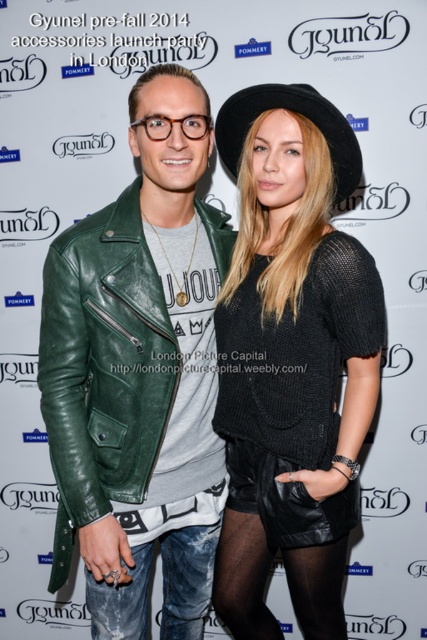
You are a photographer at the Gyunel pre fall 2014 accessories launch party in London. You need to position two markers for the guests to stand on. The markers are placed at point [328,298] and point [233,474]. Which marker is closer to the camera?

Point [328,298] is in front of point [233,474], so the marker at point [328,298] is closer to the camera.

You are a photographer at the Gyunel event and need to focus on both the green leather jacket at center and the black knitted sweater at center. Which one should you adjust your camera focus to first?

The green leather jacket at center is closer to you than the black knitted sweater at center, so you should focus on the green leather jacket at center first before adjusting for the black knitted sweater at center.